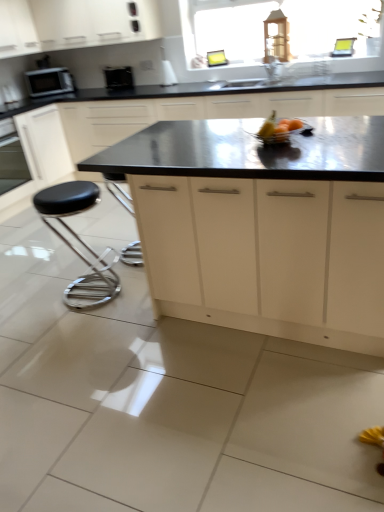
Question: From the image's perspective, is white matte cabinet at upper center, which is the 1th cabinetry from top to bottom, under white matte cabinet at upper center, arranged as the 3th cabinetry when viewed from the top?

Choices:
 (A) no
 (B) yes

Answer: (A)

Question: Is white matte cabinet at upper center, which is the 1th cabinetry from top to bottom, next to white matte cabinet at upper center, arranged as the 3th cabinetry when viewed from the top?

Choices:
 (A) no
 (B) yes

Answer: (A)

Question: From a real-world perspective, is white matte cabinet at upper center, which is the 1th cabinetry from top to bottom, under white matte cabinet at upper center, arranged as the 3th cabinetry when viewed from the top?

Choices:
 (A) yes
 (B) no

Answer: (B)

Question: Can we say white matte cabinet at upper center, which is the 1th cabinetry from top to bottom, lies outside white matte cabinet at upper center, the 2th cabinetry when ordered from bottom to top?

Choices:
 (A) yes
 (B) no

Answer: (A)

Question: Can you confirm if white matte cabinet at upper center, which is the 1th cabinetry from top to bottom, is positioned to the left of white matte cabinet at upper center, the 2th cabinetry when ordered from bottom to top?

Choices:
 (A) yes
 (B) no

Answer: (A)

Question: In the image, is white matte cabinet at upper center, which is the 1th cabinetry from top to bottom, positioned in front of or behind satin white cabinet at center, placed as the 1th cabinetry when sorted from bottom to top?

Choices:
 (A) behind
 (B) front

Answer: (A)

Question: From the image's perspective, is white matte cabinet at upper center, the 4th cabinetry in the bottom-to-top sequence, positioned above or below satin white cabinet at center, acting as the 4th cabinetry starting from the top?

Choices:
 (A) below
 (B) above

Answer: (B)

Question: Is point (8, 44) positioned closer to the camera than point (362, 303)?

Choices:
 (A) closer
 (B) farther

Answer: (B)

Question: Do you think white matte cabinet at upper center, which is the 1th cabinetry from top to bottom, is within satin white cabinet at center, acting as the 4th cabinetry starting from the top, or outside of it?

Choices:
 (A) outside
 (B) inside

Answer: (A)

Question: Is metallic silver bowl at center taller or shorter than white matte cabinet at upper left, acting as the second cabinetry starting from the top?

Choices:
 (A) tall
 (B) short

Answer: (B)

Question: Is point (294, 121) closer or farther from the camera than point (21, 34)?

Choices:
 (A) farther
 (B) closer

Answer: (B)

Question: From a real-world perspective, is metallic silver bowl at center positioned above or below white matte cabinet at upper left, acting as the second cabinetry starting from the top?

Choices:
 (A) above
 (B) below

Answer: (B)

Question: Relative to white matte cabinet at upper left, which is counted as the 3th cabinetry, starting from the bottom, is metallic silver bowl at center in front or behind?

Choices:
 (A) front
 (B) behind

Answer: (A)

Question: Does point (281, 95) appear closer or farther from the camera than point (94, 37)?

Choices:
 (A) closer
 (B) farther

Answer: (A)

Question: Is white matte cabinet at upper center, the 2th cabinetry when ordered from bottom to top, in front of or behind white matte cabinet at upper center, the 4th cabinetry in the bottom-to-top sequence, in the image?

Choices:
 (A) front
 (B) behind

Answer: (A)